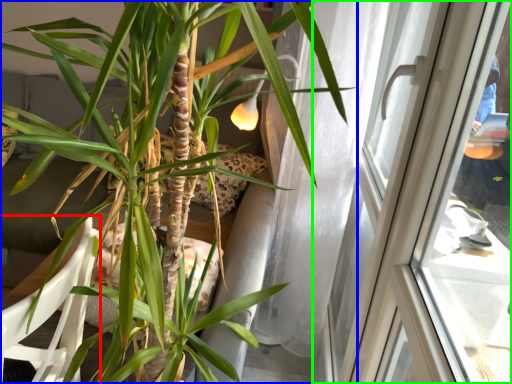
Question: Estimate the real-world distances between objects in this image. Which object is farther from armchair (highlighted by a red box), houseplant (highlighted by a blue box) or window (highlighted by a green box)?

Choices:
 (A) houseplant
 (B) window

Answer: (B)